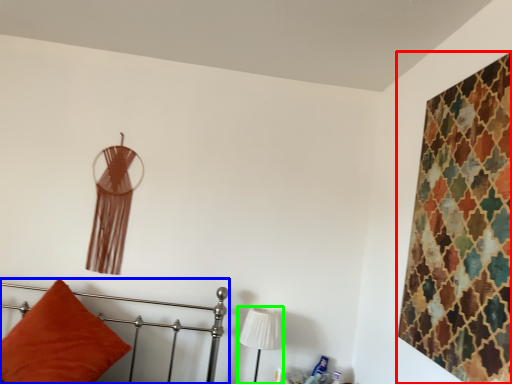
Question: Which is farther away from textile (highlighted by a red box)? furniture (highlighted by a blue box) or table lamp (highlighted by a green box)?

Choices:
 (A) furniture
 (B) table lamp

Answer: (A)